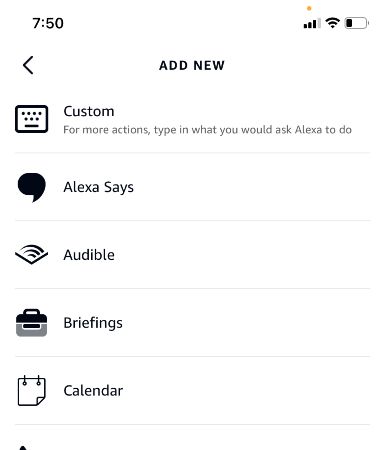
Locate an element on the screen. Image resolution: width=385 pixels, height=450 pixels. calendar is located at coordinates (27, 388).